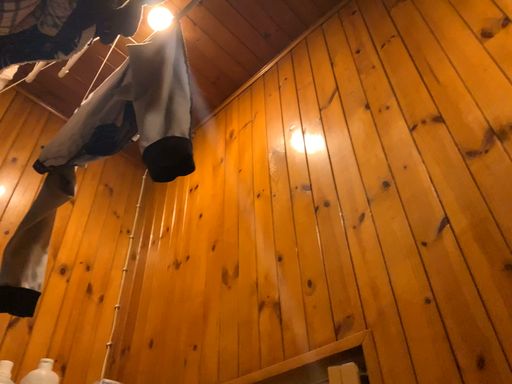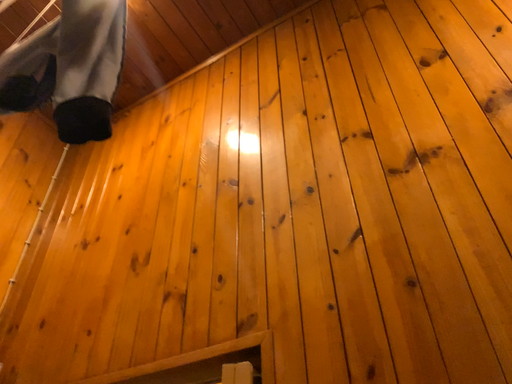
Question: How did the camera likely rotate when shooting the video?

Choices:
 (A) rotated right
 (B) rotated left

Answer: (A)